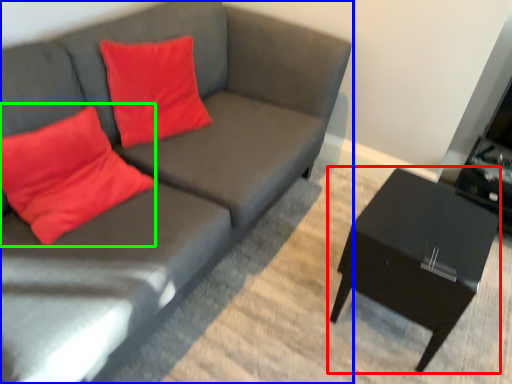
Question: Which is nearer to the table (highlighted by a red box)? studio couch (highlighted by a blue box) or throw pillow (highlighted by a green box).

Choices:
 (A) studio couch
 (B) throw pillow

Answer: (A)